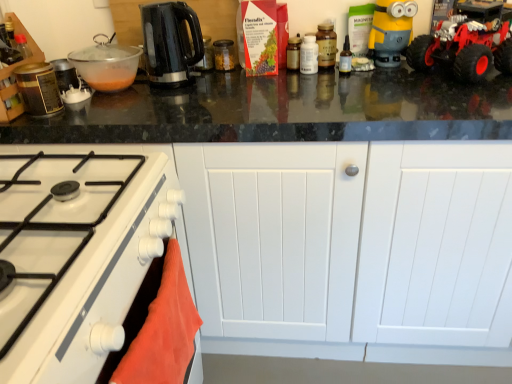
Image resolution: width=512 pixels, height=384 pixels. I want to click on white glossy bottle at center, the 2th kitchen appliance in the right-to-left sequence, so (x=309, y=55).

This screenshot has height=384, width=512. Describe the element at coordinates (76, 258) in the screenshot. I see `white glossy gas stove at lower left` at that location.

Describe the element at coordinates (391, 31) in the screenshot. The image size is (512, 384). I see `yellow matte minion toy at upper right` at that location.

The height and width of the screenshot is (384, 512). Identify the location of orange fabric towel at lower left. (163, 331).

At what (x,y) coordinates should I click in order to perform the action: click on black glossy electric kettle at upper center, which is the fifth kitchen appliance in right-to-left order. Please return your answer as a coordinate pair (x, y). Looking at the image, I should click on (x=170, y=42).

Consider the image. From a real-world perspective, between yellow matte minion toy at upper right and white glossy gas stove at lower left, who is vertically higher?

In real-world perspective, yellow matte minion toy at upper right is above.

From the image's perspective, is yellow matte minion toy at upper right located beneath white glossy gas stove at lower left?

No, from the image's perspective, yellow matte minion toy at upper right is not below white glossy gas stove at lower left.

Measure the distance from yellow matte minion toy at upper right to white glossy gas stove at lower left.

They are 3.45 feet apart.

Where is `toy behind the white glossy gas stove at lower left`? toy behind the white glossy gas stove at lower left is located at coordinates (391, 31).

Which object is thinner, matte plastic bottle at center, which appears as the fifth kitchen appliance when viewed from the left, or transparent plastic bottle at center?

transparent plastic bottle at center.

Based on the photo, from the image's perspective, is matte plastic bottle at center, which is counted as the third kitchen appliance, starting from the right, positioned above or below transparent plastic bottle at center?

matte plastic bottle at center, which is counted as the third kitchen appliance, starting from the right, is above transparent plastic bottle at center.

Which is further, (298, 43) or (346, 61)?

Point (298, 43)

Looking at this image, from a real-world perspective, is white glossy bottle at center, which is the 6th kitchen appliance in left-to-right order, physically below transparent glass jar at center, which is counted as the 4th kitchen appliance, starting from the left?

No, from a real-world perspective, white glossy bottle at center, which is the 6th kitchen appliance in left-to-right order, is not under transparent glass jar at center, which is counted as the 4th kitchen appliance, starting from the left.

Which object is thinner, white glossy bottle at center, the 2th kitchen appliance in the right-to-left sequence, or transparent glass jar at center, which ranks as the fourth kitchen appliance in right-to-left order?

Thinner between the two is white glossy bottle at center, the 2th kitchen appliance in the right-to-left sequence.

From the image's perspective, which is below, white glossy bottle at center, the 2th kitchen appliance in the right-to-left sequence, or transparent glass jar at center, which is counted as the 4th kitchen appliance, starting from the left?

white glossy bottle at center, the 2th kitchen appliance in the right-to-left sequence, appears lower in the image.

In the scene shown: Could you measure the distance between transparent plastic bottle at center and matte brown jar at upper right, the 7th kitchen appliance when ordered from left to right?

A distance of 2.15 inches exists between transparent plastic bottle at center and matte brown jar at upper right, the 7th kitchen appliance when ordered from left to right.

The width and height of the screenshot is (512, 384). Identify the location of bottle on the right of the matte brown jar at upper right, the 7th kitchen appliance when ordered from left to right. (345, 58).

Considering the sizes of objects transparent plastic bottle at center and matte brown jar at upper right, the 1th kitchen appliance when ordered from right to left, in the image provided, who is wider, transparent plastic bottle at center or matte brown jar at upper right, the 1th kitchen appliance when ordered from right to left,?

matte brown jar at upper right, the 1th kitchen appliance when ordered from right to left, is wider.

Is there a large distance between transparent plastic bottle at center and matte brown jar at upper right, the 1th kitchen appliance when ordered from right to left?

No, transparent plastic bottle at center is not far away from matte brown jar at upper right, the 1th kitchen appliance when ordered from right to left.

Locate an element on the screen. Image resolution: width=512 pixels, height=384 pixels. toy behind the orange fabric towel at lower left is located at coordinates (391, 31).

Is orange fabric towel at lower left inside the boundaries of yellow matte minion toy at upper right, or outside?

orange fabric towel at lower left is not inside yellow matte minion toy at upper right, it's outside.

Can you see orange fabric towel at lower left touching yellow matte minion toy at upper right?

They are not placed beside each other.

What's the angular difference between orange fabric towel at lower left and yellow matte minion toy at upper right's facing directions?

The facing directions of orange fabric towel at lower left and yellow matte minion toy at upper right are 90 degrees apart.

Visually, is black glossy electric kettle at upper center, which is the fifth kitchen appliance in right-to-left order, positioned to the left or to the right of transparent plastic bottle at center?

black glossy electric kettle at upper center, which is the fifth kitchen appliance in right-to-left order, is positioned on transparent plastic bottle at center's left side.

From a real-world perspective, which is physically above, black glossy electric kettle at upper center, arranged as the third kitchen appliance when viewed from the left, or transparent plastic bottle at center?

From a 3D spatial view, black glossy electric kettle at upper center, arranged as the third kitchen appliance when viewed from the left, is above.

Considering the positions of objects black glossy electric kettle at upper center, which is the fifth kitchen appliance in right-to-left order, and transparent plastic bottle at center in the image provided, who is in front, black glossy electric kettle at upper center, which is the fifth kitchen appliance in right-to-left order, or transparent plastic bottle at center?

black glossy electric kettle at upper center, which is the fifth kitchen appliance in right-to-left order, is in front.

Who is bigger, black glossy electric kettle at upper center, which is the fifth kitchen appliance in right-to-left order, or transparent plastic bottle at center?

Bigger between the two is black glossy electric kettle at upper center, which is the fifth kitchen appliance in right-to-left order.

Are matte brown jar at upper right, the 7th kitchen appliance when ordered from left to right, and matte plastic bottle at center, which appears as the fifth kitchen appliance when viewed from the left, located far from each other?

They are positioned close to each other.

This screenshot has height=384, width=512. Identify the location of kitchen appliance that is the 1st one when counting backward from the matte brown jar at upper right, the 7th kitchen appliance when ordered from left to right. (293, 53).

From a real-world perspective, which object stands above the other?

matte brown jar at upper right, the 1th kitchen appliance when ordered from right to left, is physically above.

How many degrees apart are the facing directions of matte brown jar at upper right, the 7th kitchen appliance when ordered from left to right, and matte plastic bottle at center, which is counted as the third kitchen appliance, starting from the right?

matte brown jar at upper right, the 7th kitchen appliance when ordered from left to right, and matte plastic bottle at center, which is counted as the third kitchen appliance, starting from the right, are facing 0.00108 degrees away from each other.

Where is `toy above the white glossy gas stove at lower left (from the image's perspective)`? toy above the white glossy gas stove at lower left (from the image's perspective) is located at coordinates (391, 31).

At what (x,y) coordinates should I click in order to perform the action: click on bottle located below the matte plastic bottle at center, which appears as the fifth kitchen appliance when viewed from the left (from the image's perspective). Please return your answer as a coordinate pair (x, y). This screenshot has width=512, height=384. Looking at the image, I should click on (345, 58).

From the image, which object appears to be farther from matte plastic bottle at center, which appears as the fifth kitchen appliance when viewed from the left, transparent plastic bottle at center or red rubber toy car at upper right?

red rubber toy car at upper right is positioned further to the anchor matte plastic bottle at center, which appears as the fifth kitchen appliance when viewed from the left.

Consider the image. Considering their positions, is metallic canister at left, which ranks as the 7th kitchen appliance in right-to-left order, positioned further to matte brown jar at upper right, the 7th kitchen appliance when ordered from left to right, than matte plastic bottle at center, which appears as the fifth kitchen appliance when viewed from the left?

metallic canister at left, which ranks as the 7th kitchen appliance in right-to-left order, is further to matte brown jar at upper right, the 7th kitchen appliance when ordered from left to right.

Estimate the real-world distances between objects in this image. Which object is further from yellow matte minion toy at upper right, transparent plastic bowl at upper left, the second kitchen appliance when ordered from left to right, or red rubber toy car at upper right?

Based on the image, transparent plastic bowl at upper left, the second kitchen appliance when ordered from left to right, appears to be further to yellow matte minion toy at upper right.

Estimate the real-world distances between objects in this image. Which object is closer to black glossy electric kettle at upper center, which is the fifth kitchen appliance in right-to-left order, matte plastic bottle at center, which is counted as the third kitchen appliance, starting from the right, or metallic canister at left, which is the first kitchen appliance in left-to-right order?

The object closer to black glossy electric kettle at upper center, which is the fifth kitchen appliance in right-to-left order, is metallic canister at left, which is the first kitchen appliance in left-to-right order.

Which object lies further to the anchor point matte brown jar at upper right, the 1th kitchen appliance when ordered from right to left, transparent plastic bottle at center or metallic canister at left, which ranks as the 7th kitchen appliance in right-to-left order?

Based on the image, metallic canister at left, which ranks as the 7th kitchen appliance in right-to-left order, appears to be further to matte brown jar at upper right, the 1th kitchen appliance when ordered from right to left.

In the scene shown: Looking at the image, which one is located further to transparent plastic bowl at upper left, which ranks as the sixth kitchen appliance in right-to-left order, orange fabric towel at lower left or white glossy bottle at center, which is the 6th kitchen appliance in left-to-right order?

orange fabric towel at lower left is positioned further to the anchor transparent plastic bowl at upper left, which ranks as the sixth kitchen appliance in right-to-left order.

Looking at the image, which one is located closer to matte plastic bottle at center, which is counted as the third kitchen appliance, starting from the right, transparent glass jar at center, which is counted as the 4th kitchen appliance, starting from the left, or orange fabric towel at lower left?

transparent glass jar at center, which is counted as the 4th kitchen appliance, starting from the left.

From the image, which object appears to be nearer to transparent plastic bottle at center, yellow matte minion toy at upper right or matte brown jar at upper right, the 7th kitchen appliance when ordered from left to right?

matte brown jar at upper right, the 7th kitchen appliance when ordered from left to right, is positioned closer to the anchor transparent plastic bottle at center.

Locate an element on the screen. bottle located between metallic canister at left, which is the first kitchen appliance in left-to-right order, and red rubber toy car at upper right in the left-right direction is located at coordinates (345, 58).

Identify the location of bottle between transparent glass jar at center, which ranks as the fourth kitchen appliance in right-to-left order, and yellow matte minion toy at upper right. This screenshot has height=384, width=512. (345, 58).

This screenshot has width=512, height=384. In order to click on kitchen appliance between white glossy bottle at center, which is the 6th kitchen appliance in left-to-right order, and yellow matte minion toy at upper right in this screenshot , I will do `click(326, 45)`.

Where is `material located between metallic canister at left, which ranks as the 7th kitchen appliance in right-to-left order, and transparent plastic bottle at center in the left-right direction`? material located between metallic canister at left, which ranks as the 7th kitchen appliance in right-to-left order, and transparent plastic bottle at center in the left-right direction is located at coordinates (163, 331).